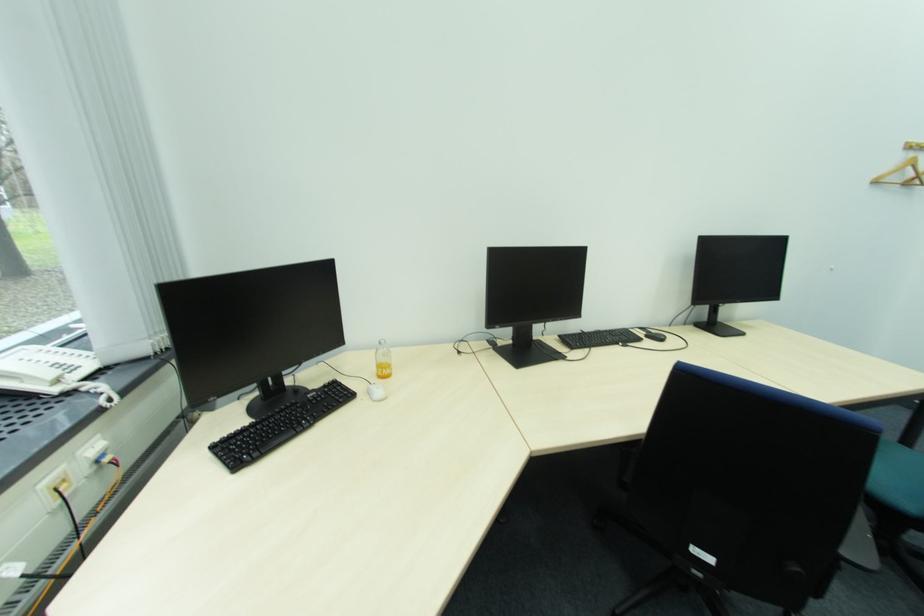
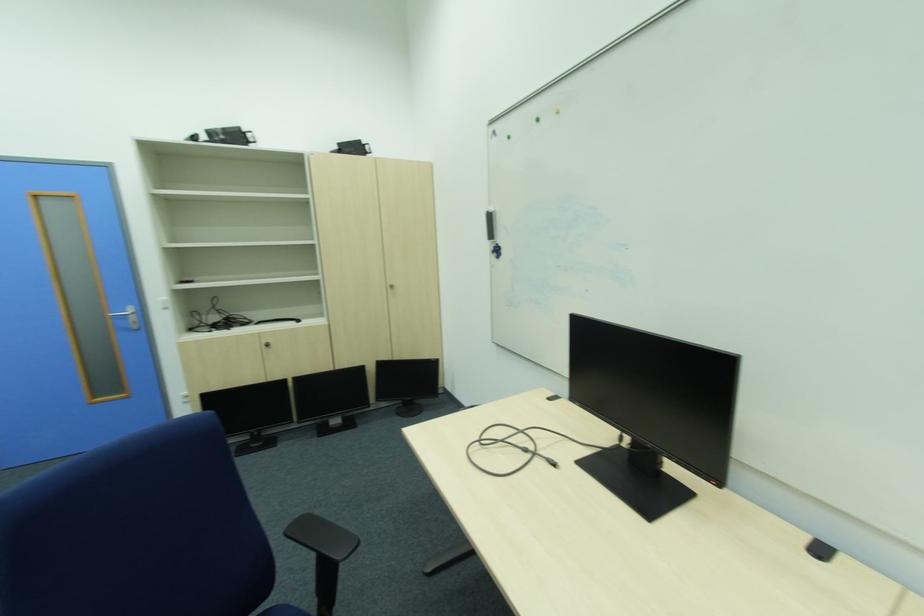
The first image is from the beginning of the video and the second image is from the end. How did the camera likely rotate when shooting the video?

The rotation direction of the camera is right-down.